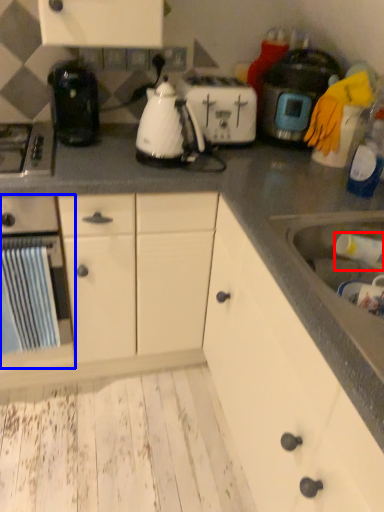
Question: Which point is further to the camera, bottle (highlighted by a red box) or kitchen appliance (highlighted by a blue box)?

Choices:
 (A) bottle
 (B) kitchen appliance

Answer: (B)